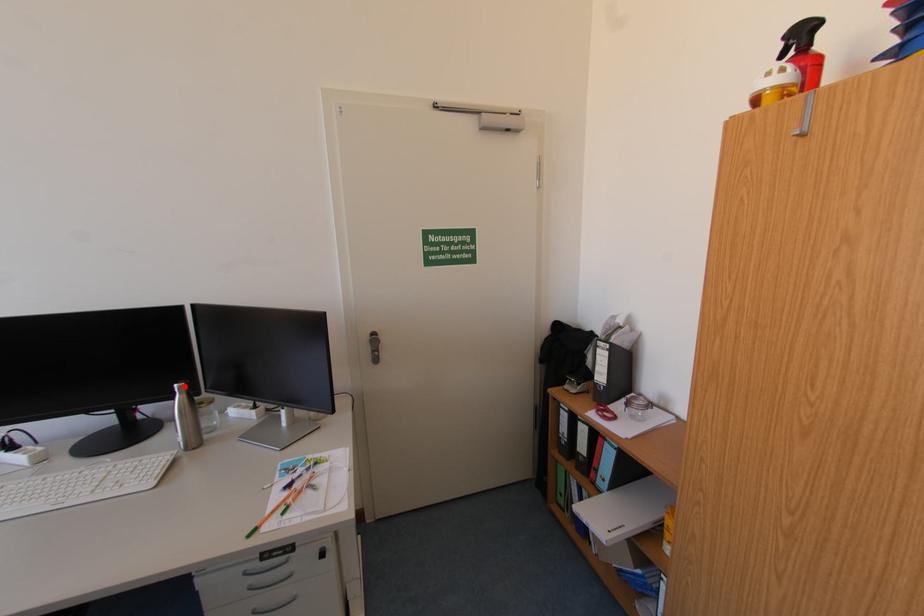
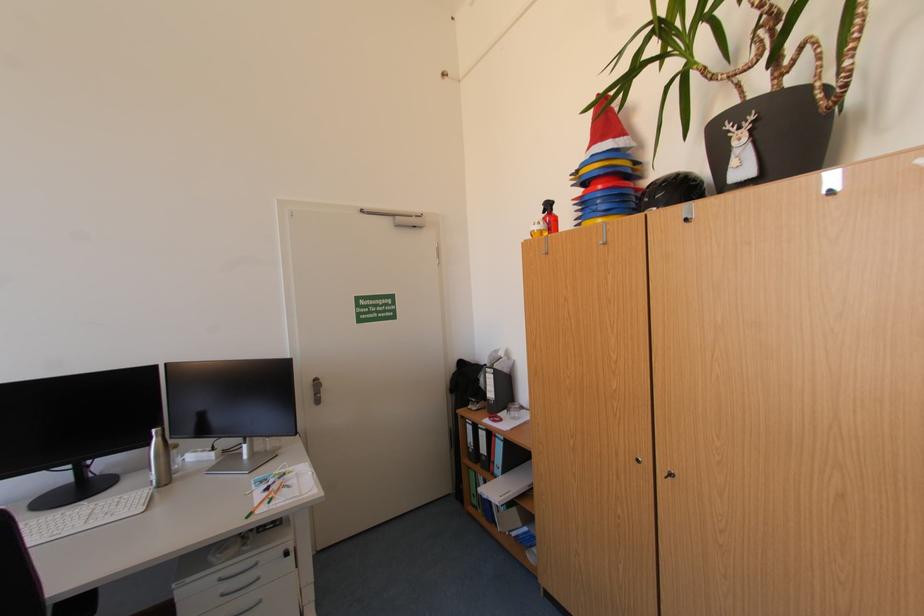
In the second image, find the point that corresponds to the highlighted location in the first image.

(161, 431)